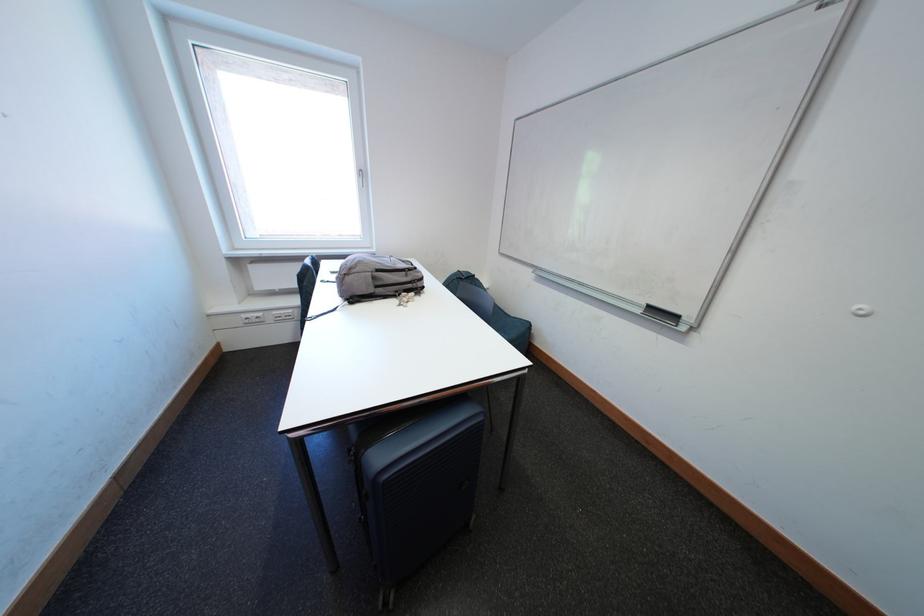
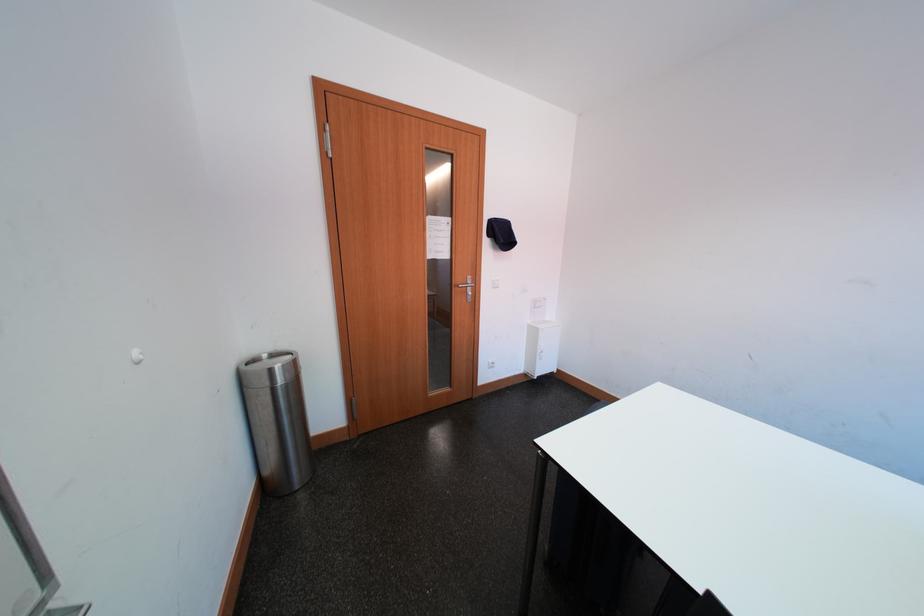
Question: I am providing you with two images of the same scene from different viewpoints. After the viewpoint changes to image2, which objects are now occluded?

Choices:
 (A) red top canister
 (B) trash can lid
 (C) metal door handle
 (D) black suitcase handle

Answer: (D)